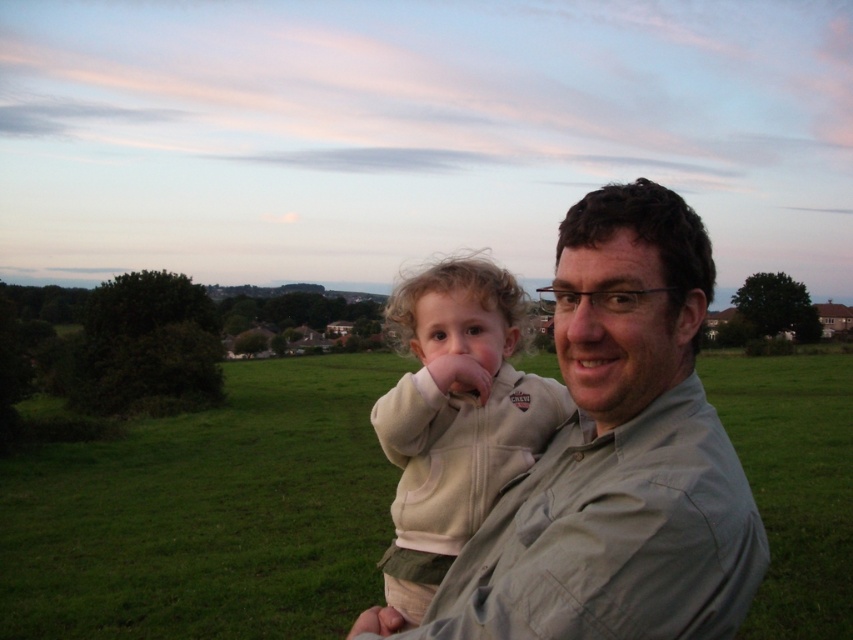
Question: Is green grass at center bigger than light beige fleece at center?

Choices:
 (A) yes
 (B) no

Answer: (A)

Question: Which of the following is the closest to the observer?

Choices:
 (A) light beige fleece at center
 (B) light gray shirt at center
 (C) green grass at center

Answer: (B)

Question: Which of the following is the closest to the observer?

Choices:
 (A) green grass at center
 (B) light beige fleece at center

Answer: (A)

Question: Can you confirm if green grass at center is positioned above light beige fleece at center?

Choices:
 (A) yes
 (B) no

Answer: (B)

Question: Which object appears closest to the camera in this image?

Choices:
 (A) green grass at center
 (B) light gray shirt at center
 (C) light beige fleece at center

Answer: (B)

Question: From the image, what is the correct spatial relationship of green grass at center in relation to light gray shirt at center?

Choices:
 (A) left
 (B) right

Answer: (B)